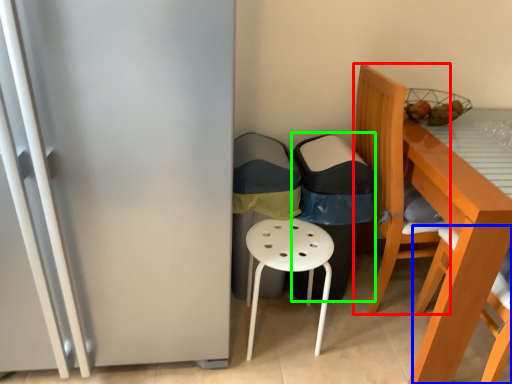
Question: Which object is the closest to the chair (highlighted by a red box)? Choose among these: chair (highlighted by a blue box) or garbage (highlighted by a green box).

Choices:
 (A) chair
 (B) garbage

Answer: (B)